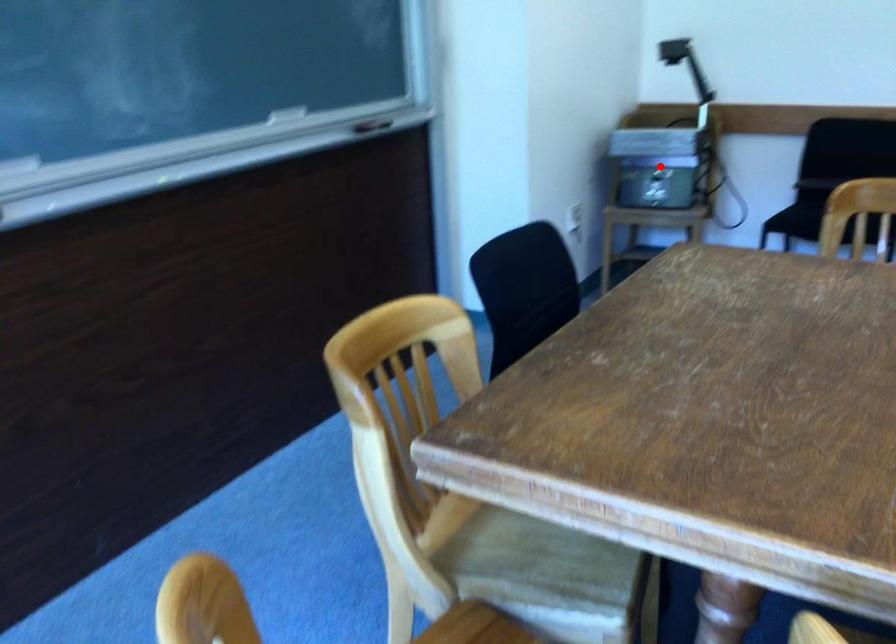
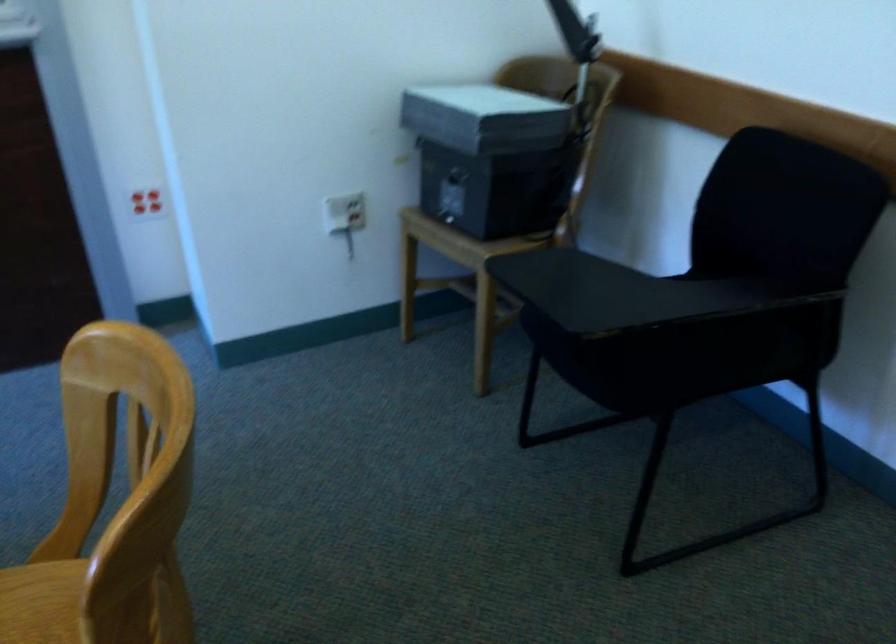
Question: I am providing you with two images of the same scene from different viewpoints. A red point is marked on the first image. Can you still see the location of the red point in image 2?

Choices:
 (A) Yes
 (B) No

Answer: (B)